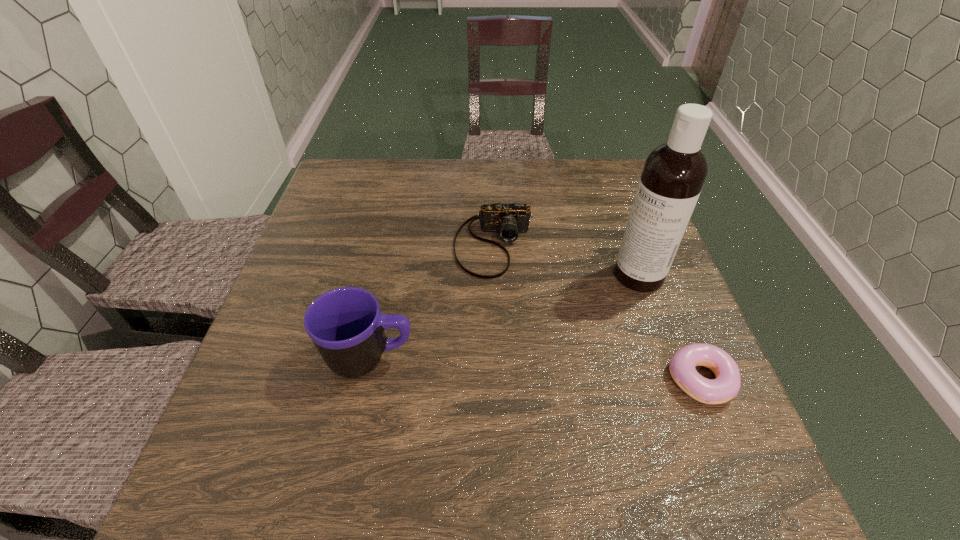
Locate an element on the screen. the leftmost object is located at coordinates (345, 324).

Where is `the second tallest object`? Image resolution: width=960 pixels, height=540 pixels. the second tallest object is located at coordinates (345, 324).

Where is `doughnut`? Image resolution: width=960 pixels, height=540 pixels. doughnut is located at coordinates (682, 365).

Find the location of a particular element. dishwasher detergent is located at coordinates (674, 173).

Where is `the second shortest object`? the second shortest object is located at coordinates (510, 219).

At what (x,y) coordinates should I click in order to perform the action: click on camera. Please return your answer as a coordinate pair (x, y). The height and width of the screenshot is (540, 960). Looking at the image, I should click on (510, 219).

Where is `free space located with the handle on the side of the third shortest object`? The width and height of the screenshot is (960, 540). free space located with the handle on the side of the third shortest object is located at coordinates (544, 358).

This screenshot has height=540, width=960. I want to click on vacant position located on the left of the shortest object, so click(508, 380).

Locate an element on the screen. The width and height of the screenshot is (960, 540). vacant space located 0.050m on the label side of the tallest object is located at coordinates (608, 296).

Where is `vacant point located 0.220m on the label side of the tallest object`? This screenshot has height=540, width=960. vacant point located 0.220m on the label side of the tallest object is located at coordinates (552, 333).